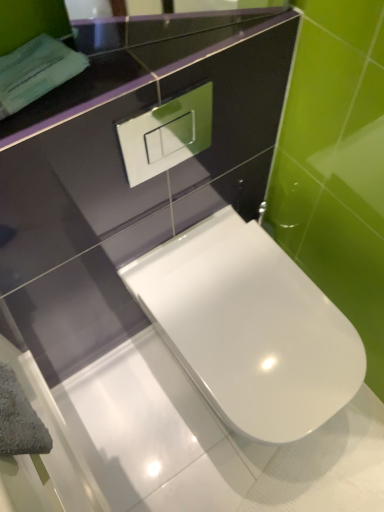
Question: Is glossy black mirror at upper center a part of white glossy toilet at center?

Choices:
 (A) yes
 (B) no

Answer: (B)

Question: Considering the relative sizes of white glossy toilet at center and glossy black mirror at upper center in the image provided, is white glossy toilet at center shorter than glossy black mirror at upper center?

Choices:
 (A) yes
 (B) no

Answer: (B)

Question: Is white glossy toilet at center looking in the opposite direction of glossy black mirror at upper center?

Choices:
 (A) yes
 (B) no

Answer: (B)

Question: From the image's perspective, would you say white glossy toilet at center is positioned over glossy black mirror at upper center?

Choices:
 (A) yes
 (B) no

Answer: (B)

Question: Is white glossy toilet at center not within glossy black mirror at upper center?

Choices:
 (A) yes
 (B) no

Answer: (A)

Question: Can you confirm if white glossy toilet at center is thinner than glossy black mirror at upper center?

Choices:
 (A) no
 (B) yes

Answer: (A)

Question: From the image's perspective, is glossy black mirror at upper center beneath white glossy toilet at center?

Choices:
 (A) yes
 (B) no

Answer: (B)

Question: Can you confirm if glossy black mirror at upper center is shorter than white glossy toilet at center?

Choices:
 (A) yes
 (B) no

Answer: (A)

Question: Could white glossy toilet at center be considered to be inside glossy black mirror at upper center?

Choices:
 (A) no
 (B) yes

Answer: (A)

Question: Could you tell me if glossy black mirror at upper center is facing white glossy toilet at center?

Choices:
 (A) yes
 (B) no

Answer: (B)

Question: Is glossy black mirror at upper center closer to the viewer compared to white glossy toilet at center?

Choices:
 (A) no
 (B) yes

Answer: (B)

Question: Does glossy black mirror at upper center appear on the right side of white glossy toilet at center?

Choices:
 (A) yes
 (B) no

Answer: (B)

Question: Which is correct: glossy black mirror at upper center is inside white glossy toilet at center, or outside of it?

Choices:
 (A) outside
 (B) inside

Answer: (A)